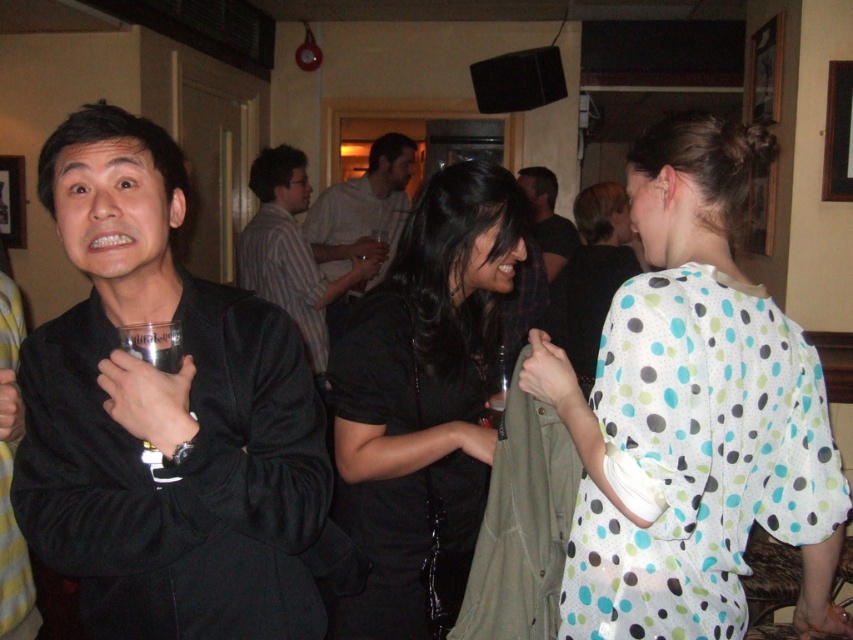
Question: Can you confirm if black matte shirt at center is wider than striped cotton shirt at center?

Choices:
 (A) yes
 (B) no

Answer: (B)

Question: Which point is farther to the camera?

Choices:
 (A) black matte shirt at center
 (B) light brown shirt at center
 (C) white dotted dress at center
 (D) white polka dot blouse at center

Answer: (B)

Question: Is black matte jacket at left closer to the viewer compared to light brown shirt at center?

Choices:
 (A) yes
 (B) no

Answer: (A)

Question: Is black matte shirt at center to the right of light brown shirt at center from the viewer's perspective?

Choices:
 (A) yes
 (B) no

Answer: (A)

Question: Which object is farther from the camera taking this photo?

Choices:
 (A) white polka dot blouse at center
 (B) white dotted dress at center

Answer: (B)

Question: Considering the real-world distances, which object is closest to the light brown shirt at center?

Choices:
 (A) dark gray shirt at center
 (B) black matte shirt at center
 (C) white polka dot blouse at center

Answer: (A)